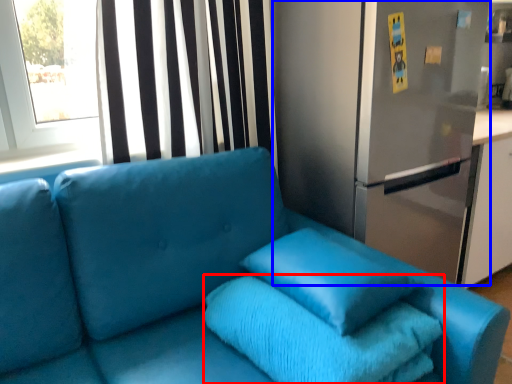
Question: Among these objects, which one is nearest to the camera, bath towel (highlighted by a red box) or fridge (highlighted by a blue box)?

Choices:
 (A) bath towel
 (B) fridge

Answer: (A)